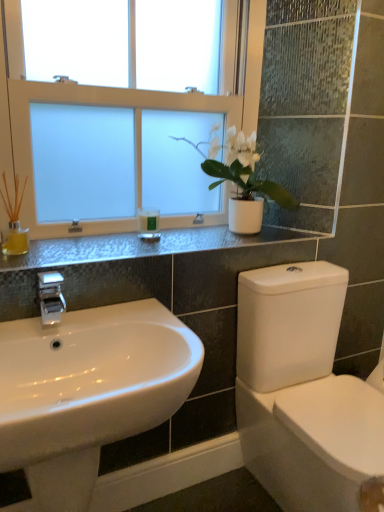
In order to face white matte plant pot at upper center, should I rotate leftwards or rightwards?

Turn right approximately 6.399 degrees to face it.

Image resolution: width=384 pixels, height=512 pixels. I want to click on metallic gray counter top at upper center, so click(141, 246).

Measure the distance between point (158, 221) and camera.

The distance of point (158, 221) from camera is 1.66 meters.

The width and height of the screenshot is (384, 512). I want to click on white glossy bidet at lower right, so click(313, 441).

In order to face white frosted glass window at upper center, should I rotate leftwards or rightwards?

It's best to rotate left around 7.321 degrees.

Locate an element on the screen. The height and width of the screenshot is (512, 384). silver metallic faucet at left is located at coordinates (50, 298).

Where is `bidet in front of the metallic gray counter top at upper center`? bidet in front of the metallic gray counter top at upper center is located at coordinates (313, 441).

Is metallic gray counter top at upper center positioned with its back to white glossy bidet at lower right?

No, metallic gray counter top at upper center is not facing away from white glossy bidet at lower right.

Between point (5, 270) and point (335, 391), which one is positioned in front?

The point (5, 270) is closer.

Is the position of metallic gray counter top at upper center more distant than that of white glossy bidet at lower right?

Yes.

Considering the sizes of objects green matte candle at center and silver metallic faucet at left in the image provided, who is shorter, green matte candle at center or silver metallic faucet at left?

Standing shorter between the two is green matte candle at center.

From the image's perspective, which is below, green matte candle at center or silver metallic faucet at left?

From the image's view, silver metallic faucet at left is below.

Does green matte candle at center turn towards silver metallic faucet at left?

No.

Is green matte candle at center in contact with silver metallic faucet at left?

No, green matte candle at center is not touching silver metallic faucet at left.

Considering the relative sizes of silver metallic faucet at left and white matte plant pot at upper center in the image provided, is silver metallic faucet at left shorter than white matte plant pot at upper center?

Yes, silver metallic faucet at left is shorter than white matte plant pot at upper center.

From the image's perspective, is silver metallic faucet at left under white matte plant pot at upper center?

Indeed, from the image's perspective, silver metallic faucet at left is shown beneath white matte plant pot at upper center.

From a real-world perspective, is silver metallic faucet at left positioned over white matte plant pot at upper center based on gravity?

No.

Which is more to the right, white glossy bidet at lower right or silver metallic faucet at left?

Positioned to the right is white glossy bidet at lower right.

Which of these two, white glossy bidet at lower right or silver metallic faucet at left, is bigger?

Bigger between the two is white glossy bidet at lower right.

Is silver metallic faucet at left at the back of white glossy bidet at lower right?

No, white glossy bidet at lower right is not facing the opposite direction of silver metallic faucet at left.

From the image's perspective, is metallic gray counter top at upper center above silver metallic faucet at left?

Indeed, from the image's perspective, metallic gray counter top at upper center is shown above silver metallic faucet at left.

Considering the relative sizes of metallic gray counter top at upper center and silver metallic faucet at left in the image provided, is metallic gray counter top at upper center taller than silver metallic faucet at left?

In fact, metallic gray counter top at upper center may be shorter than silver metallic faucet at left.

Does metallic gray counter top at upper center turn towards silver metallic faucet at left?

No.

Does point (296, 239) lie behind point (60, 300)?

Yes, point (296, 239) is behind point (60, 300).

From the picture: Is white glossy bidet at lower right spatially inside white frosted glass window at upper center, or outside of it?

white glossy bidet at lower right lies outside white frosted glass window at upper center.

Considering the relative sizes of white glossy bidet at lower right and white frosted glass window at upper center in the image provided, is white glossy bidet at lower right taller than white frosted glass window at upper center?

In fact, white glossy bidet at lower right may be shorter than white frosted glass window at upper center.

Which object is thinner, white glossy bidet at lower right or white frosted glass window at upper center?

With smaller width is white frosted glass window at upper center.

From the image's perspective, would you say white glossy bidet at lower right is shown under white frosted glass window at upper center?

Yes.

Where is `houseplant above the silver metallic faucet at left (from the image's perspective)`? houseplant above the silver metallic faucet at left (from the image's perspective) is located at coordinates (240, 168).

Which is in front, point (262, 181) or point (51, 303)?

The point (51, 303) is closer.

Considering the relative sizes of white matte plant pot at upper center and silver metallic faucet at left in the image provided, is white matte plant pot at upper center wider than silver metallic faucet at left?

Yes.

The height and width of the screenshot is (512, 384). In order to click on bidet below the metallic gray counter top at upper center (from a real-world perspective) in this screenshot , I will do `click(313, 441)`.

The height and width of the screenshot is (512, 384). What are the coordinates of `toiletry behind the silver metallic faucet at left` in the screenshot? It's located at (148, 224).

When comparing their distances from metallic gray counter top at upper center, does white glossy sink at lower left or white matte plant pot at upper center seem further?

white glossy sink at lower left.

Based on the photo, looking at the image, which one is located closer to white glossy bidet at lower right, metallic gray counter top at upper center or white glossy sink at lower left?

Based on the image, white glossy sink at lower left appears to be nearer to white glossy bidet at lower right.

Looking at the image, which one is located further to silver metallic faucet at left, green matte candle at center or metallic gray counter top at upper center?

green matte candle at center is positioned further to the anchor silver metallic faucet at left.

Which object lies further to the anchor point white matte plant pot at upper center, metallic gray counter top at upper center or green matte candle at center?

green matte candle at center is further to white matte plant pot at upper center.

When comparing their distances from white frosted glass window at upper center, does white glossy bidet at lower right or metallic gray counter top at upper center seem closer?

metallic gray counter top at upper center is closer to white frosted glass window at upper center.

Looking at the image, which one is located further to silver metallic faucet at left, white glossy bidet at lower right or metallic gray counter top at upper center?

white glossy bidet at lower right is further to silver metallic faucet at left.

When comparing their distances from white glossy sink at lower left, does white frosted glass window at upper center or green matte candle at center seem closer?

Among the two, green matte candle at center is located nearer to white glossy sink at lower left.

In the scene shown: Considering their positions, is white glossy sink at lower left positioned further to green matte candle at center than metallic gray counter top at upper center?

white glossy sink at lower left lies further to green matte candle at center than the other object.

Locate an element on the screen. The image size is (384, 512). plumbing fixture between white matte plant pot at upper center and white glossy sink at lower left in the up-down direction is located at coordinates (50, 298).

Find the location of a particular element. counter top located between white glossy sink at lower left and white glossy bidet at lower right in the left-right direction is located at coordinates (141, 246).

Locate an element on the screen. The width and height of the screenshot is (384, 512). toiletry between white frosted glass window at upper center and white glossy sink at lower left from top to bottom is located at coordinates (148, 224).

At what (x,y) coordinates should I click in order to perform the action: click on counter top between silver metallic faucet at left and green matte candle at center in the front-back direction. Please return your answer as a coordinate pair (x, y). Looking at the image, I should click on (141, 246).